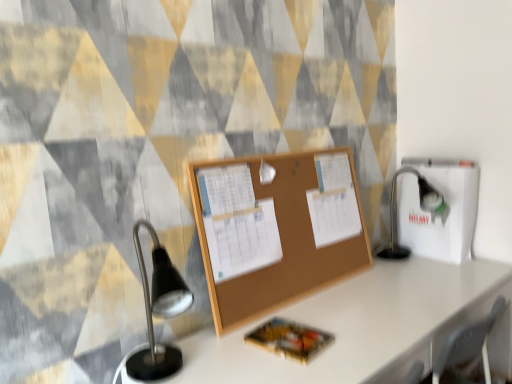
Question: From the image's perspective, is black metal table lamp at right above or below corkboard at center?

Choices:
 (A) below
 (B) above

Answer: (A)

Question: Looking at the image, does black metal table lamp at right seem bigger or smaller compared to corkboard at center?

Choices:
 (A) small
 (B) big

Answer: (B)

Question: Which object is the closest to the white cardboard box at right?

Choices:
 (A) black metal table lamp at right
 (B) corkboard at center

Answer: (A)

Question: Which of these objects is positioned closest to the corkboard at center?

Choices:
 (A) black metal table lamp at right
 (B) white cardboard box at right

Answer: (B)